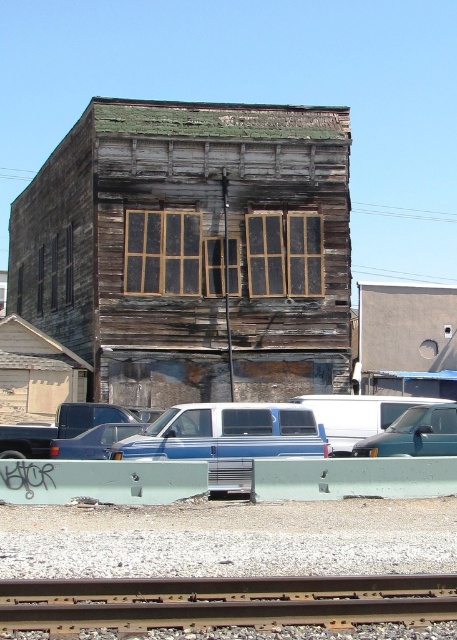
Which of these two, brown metal train track at bottom or teal matte van at center, stands taller?

With more height is teal matte van at center.

Is point (49, 612) closer to camera compared to point (355, 448)?

Yes, point (49, 612) is closer to viewer.

I want to click on brown metal train track at bottom, so click(x=223, y=602).

Which is above, teal matte van at center or blue matte van at center?

teal matte van at center is above.

Is point (426, 432) in front of point (105, 456)?

Yes.

Does point (382, 438) come in front of point (113, 435)?

Yes.

In order to click on teal matte van at center in this screenshot , I will do `click(414, 433)`.

Is the position of brown metal train track at bottom less distant than that of blue metallic van at center?

That is True.

Between brown metal train track at bottom and blue metallic van at center, which one appears on the left side from the viewer's perspective?

blue metallic van at center is more to the left.

Locate an element on the screen. This screenshot has height=640, width=457. brown metal train track at bottom is located at coordinates (223, 602).